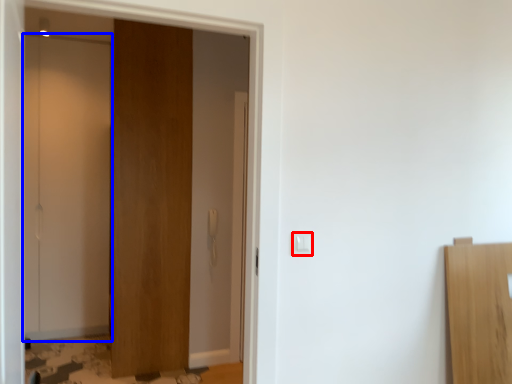
Question: Among these objects, which one is farthest to the camera, light switch (highlighted by a red box) or door (highlighted by a blue box)?

Choices:
 (A) light switch
 (B) door

Answer: (B)